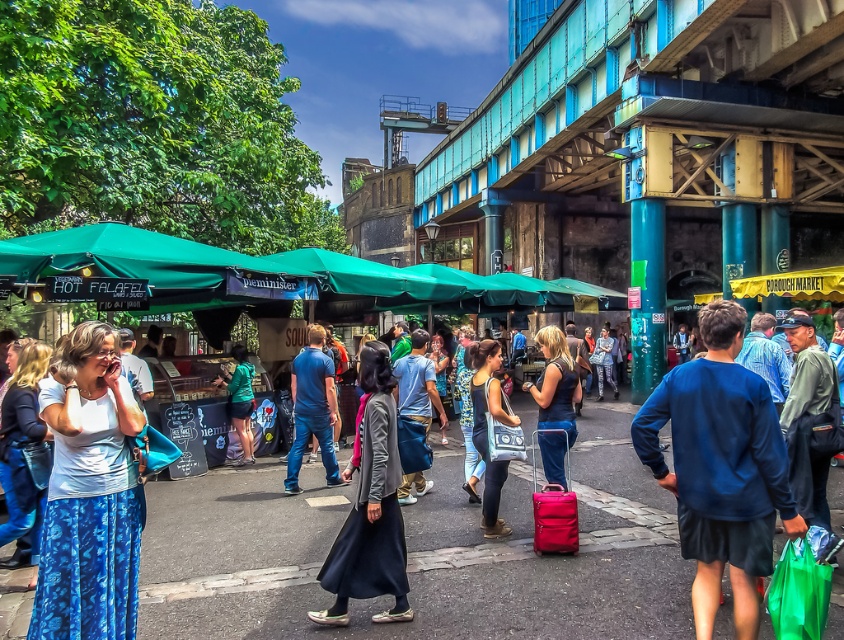
Based on the photo, who is more distant from viewer, (293, 388) or (237, 378)?

The point (237, 378) is more distant.

Does blue denim jeans at center have a greater height compared to green fabric jacket at center?

Yes.

This screenshot has width=844, height=640. Find the location of `blue denim jeans at center`. blue denim jeans at center is located at coordinates (312, 408).

You are a GUI agent. You are given a task and a screenshot of the screen. Output one action in this format:
    pyautogui.click(x=<x>, y=<y>)
    Task: Click on the blue denim jeans at center
    The height and width of the screenshot is (640, 844).
    Given the screenshot: What is the action you would take?
    pyautogui.click(x=312, y=408)

Is blue fabric sweatshirt at center bigger than green fabric jacket at center?

No.

You are a GUI agent. You are given a task and a screenshot of the screen. Output one action in this format:
    pyautogui.click(x=<x>, y=<y>)
    Task: Click on the blue fabric sweatshirt at center
    This screenshot has width=844, height=640.
    Given the screenshot: What is the action you would take?
    pyautogui.click(x=720, y=468)

The height and width of the screenshot is (640, 844). I want to click on blue fabric sweatshirt at center, so click(720, 468).

Where is `blue fabric sweatshirt at center`? blue fabric sweatshirt at center is located at coordinates (720, 468).

The image size is (844, 640). In order to click on dark gray fabric coat at center in this screenshot , I will do `click(371, 506)`.

Is dark gray fabric coat at center to the right of blue denim jeans at center from the viewer's perspective?

Yes, dark gray fabric coat at center is to the right of blue denim jeans at center.

Image resolution: width=844 pixels, height=640 pixels. I want to click on dark gray fabric coat at center, so click(371, 506).